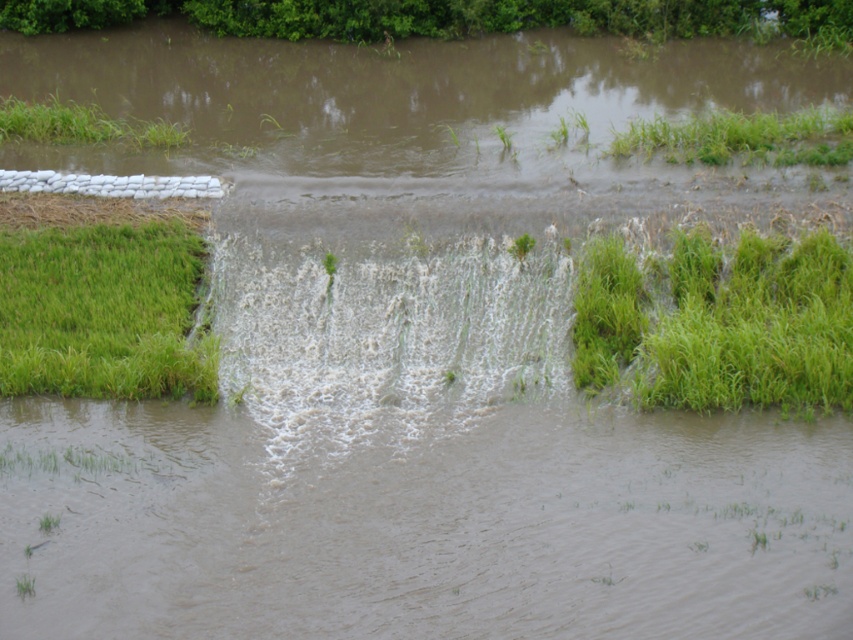
You are a hiker trying to cross the flooded area. You see the green grass at upper left and the green matte grass at center. Which area should you avoid stepping on to stay safe?

You should avoid stepping on the green matte grass at center because the green grass at upper left is positioned over it, indicating it might be submerged or less stable due to the flooding.

Looking at this image, you are standing at the edge of the flooded waterway and see two points marked in the scene. Which point, point (822, 148) or point (505, 141), is closer to you?

Point (822, 148) is closer to the viewer than point (505, 141).